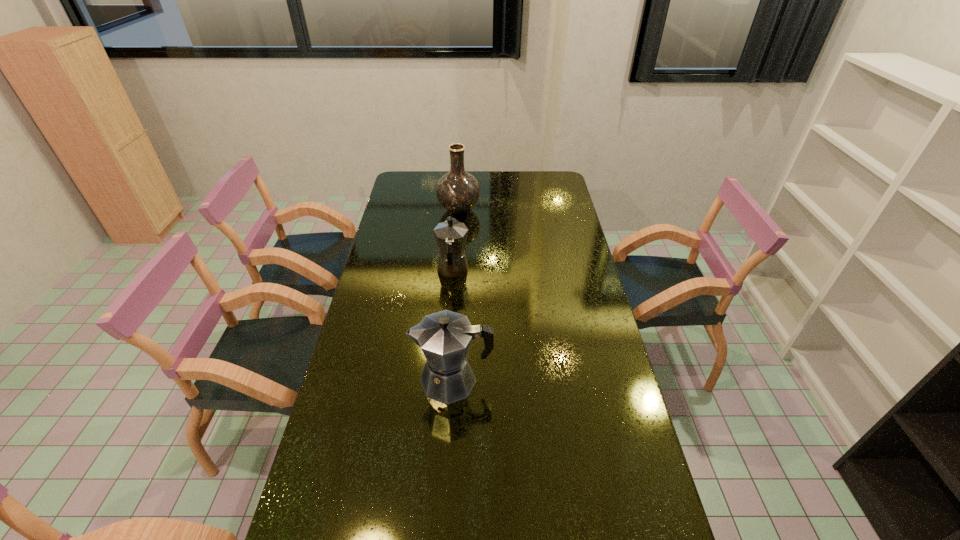
In order to click on the farthest object in this screenshot , I will do `click(458, 191)`.

Locate an element on the screen. the nearer coffeepot is located at coordinates (444, 337).

Locate an element on the screen. The width and height of the screenshot is (960, 540). the farther coffeepot is located at coordinates (451, 235).

At what (x,y) coordinates should I click in order to perform the action: click on vacant space situated 0.330m on the front of the farthest object. Please return your answer as a coordinate pair (x, y). Looking at the image, I should click on (455, 269).

Where is `vacant space situated at the spout of the nearest object`? This screenshot has width=960, height=540. vacant space situated at the spout of the nearest object is located at coordinates (390, 380).

Find the location of a particular element. vacant area located 0.090m at the spout of the nearest object is located at coordinates (383, 380).

Identify the location of free space located at the spout of the nearest object. Image resolution: width=960 pixels, height=540 pixels. (366, 380).

Find the location of `free space located on the pouring side of the second nearest object`. free space located on the pouring side of the second nearest object is located at coordinates (456, 219).

The width and height of the screenshot is (960, 540). In order to click on free space located on the pouring side of the second nearest object in this screenshot , I will do `click(455, 241)`.

This screenshot has height=540, width=960. In order to click on free point located on the pouring side of the second nearest object in this screenshot , I will do `click(455, 232)`.